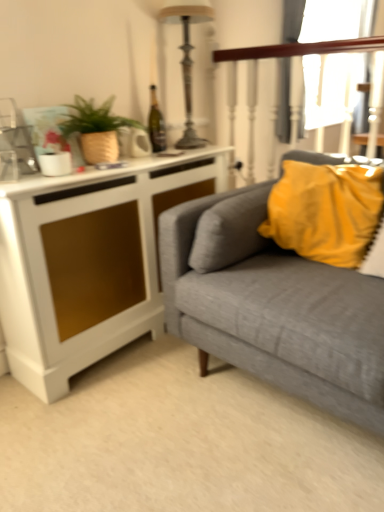
Find the location of `free location above white matte cabinet at left (from a real-world perspective)`. free location above white matte cabinet at left (from a real-world perspective) is located at coordinates (126, 158).